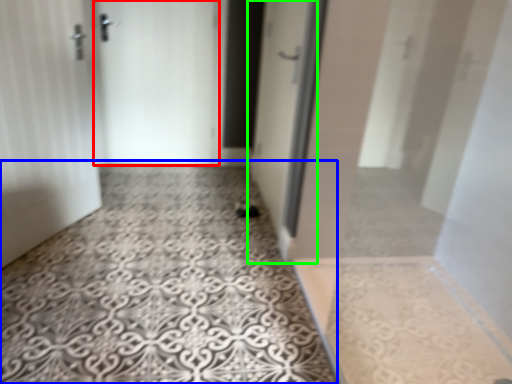
Question: Based on their relative distances, which object is nearer to door (highlighted by a red box)? Choose from concrete (highlighted by a blue box) and door (highlighted by a green box).

Choices:
 (A) concrete
 (B) door

Answer: (B)